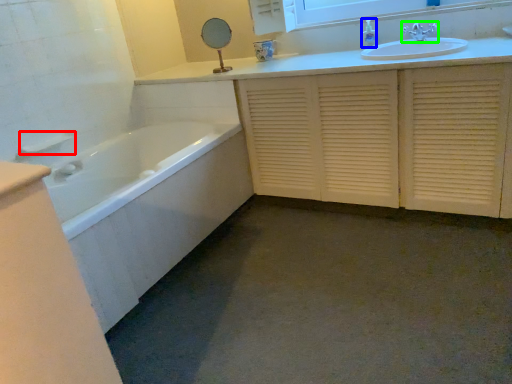
Question: Which is farther away from towel bar (highlighted by a red box)? toiletry (highlighted by a blue box) or tap (highlighted by a green box)?

Choices:
 (A) toiletry
 (B) tap

Answer: (B)